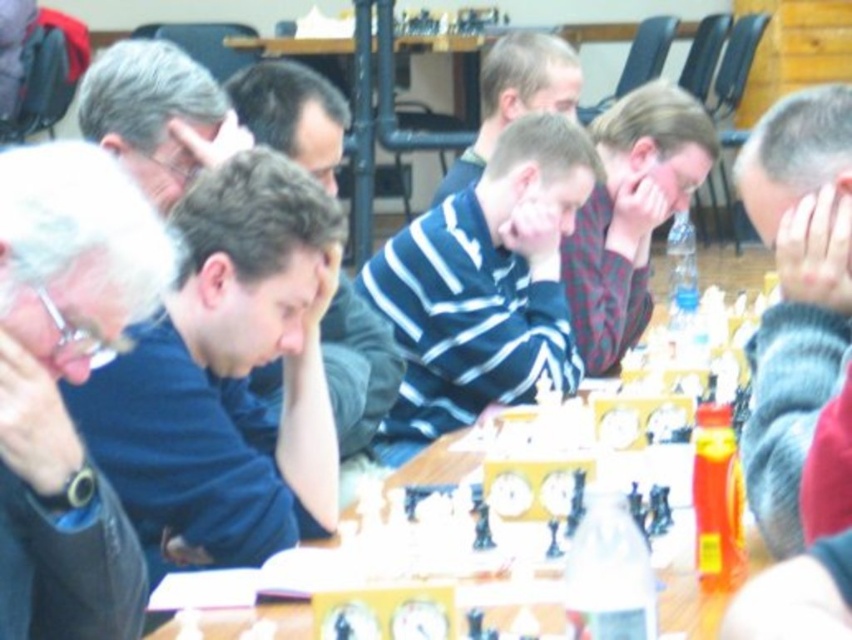
In the scene shown: You are a photographer taking a photo of the chess tournament participants. You want to ensure both the dark blue shirt at center and the plaid fabric shirt at center are clearly visible in the photo. Based on their positions, which shirt should you focus on to capture both effectively?

The dark blue shirt at center is in front of the plaid fabric shirt at center. To ensure both are clearly visible, focus on the dark blue shirt at center first since it is closer to the camera, and adjust the depth of field to include the plaid fabric shirt at center in the background.